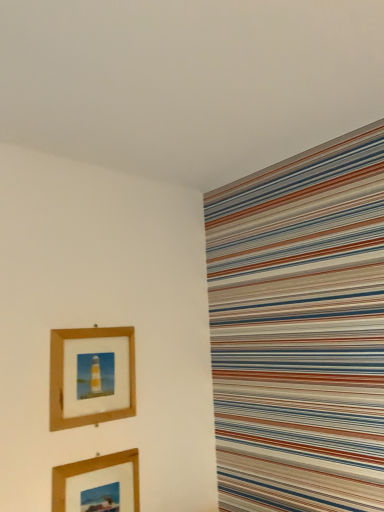
Question: From the image's perspective, is wooden picture frame at lower left, positioned as the 2th picture frame in top-to-bottom order, located beneath wooden picture frame at upper left, the second picture frame in the bottom-to-top sequence?

Choices:
 (A) no
 (B) yes

Answer: (B)

Question: Is wooden picture frame at lower left, acting as the first picture frame starting from the bottom, facing away from wooden picture frame at upper left, which is counted as the 1th picture frame, starting from the top?

Choices:
 (A) yes
 (B) no

Answer: (B)

Question: Is wooden picture frame at lower left, acting as the first picture frame starting from the bottom, far away from wooden picture frame at upper left, the second picture frame in the bottom-to-top sequence?

Choices:
 (A) yes
 (B) no

Answer: (B)

Question: Is wooden picture frame at lower left, acting as the first picture frame starting from the bottom, oriented towards wooden picture frame at upper left, the second picture frame in the bottom-to-top sequence?

Choices:
 (A) yes
 (B) no

Answer: (B)

Question: Is wooden picture frame at lower left, acting as the first picture frame starting from the bottom, positioned beyond the bounds of wooden picture frame at upper left, which is counted as the 1th picture frame, starting from the top?

Choices:
 (A) no
 (B) yes

Answer: (B)

Question: Is wooden picture frame at lower left, positioned as the 2th picture frame in top-to-bottom order, smaller than wooden picture frame at upper left, the second picture frame in the bottom-to-top sequence?

Choices:
 (A) yes
 (B) no

Answer: (A)

Question: Is wooden picture frame at upper left, the second picture frame in the bottom-to-top sequence, outside of wooden picture frame at lower left, acting as the first picture frame starting from the bottom?

Choices:
 (A) no
 (B) yes

Answer: (B)

Question: Is wooden picture frame at upper left, which is counted as the 1th picture frame, starting from the top, wider than wooden picture frame at lower left, acting as the first picture frame starting from the bottom?

Choices:
 (A) yes
 (B) no

Answer: (A)

Question: Are wooden picture frame at upper left, the second picture frame in the bottom-to-top sequence, and wooden picture frame at lower left, positioned as the 2th picture frame in top-to-bottom order, far apart?

Choices:
 (A) yes
 (B) no

Answer: (B)

Question: Is wooden picture frame at upper left, which is counted as the 1th picture frame, starting from the top, positioned behind wooden picture frame at lower left, positioned as the 2th picture frame in top-to-bottom order?

Choices:
 (A) no
 (B) yes

Answer: (B)

Question: Would you say wooden picture frame at lower left, acting as the first picture frame starting from the bottom, is part of wooden picture frame at upper left, the second picture frame in the bottom-to-top sequence,'s contents?

Choices:
 (A) yes
 (B) no

Answer: (B)

Question: From the image's perspective, is wooden picture frame at upper left, which is counted as the 1th picture frame, starting from the top, above wooden picture frame at lower left, positioned as the 2th picture frame in top-to-bottom order?

Choices:
 (A) no
 (B) yes

Answer: (B)

Question: Do you think wooden picture frame at upper left, the second picture frame in the bottom-to-top sequence, is within wooden picture frame at lower left, acting as the first picture frame starting from the bottom, or outside of it?

Choices:
 (A) inside
 (B) outside

Answer: (B)